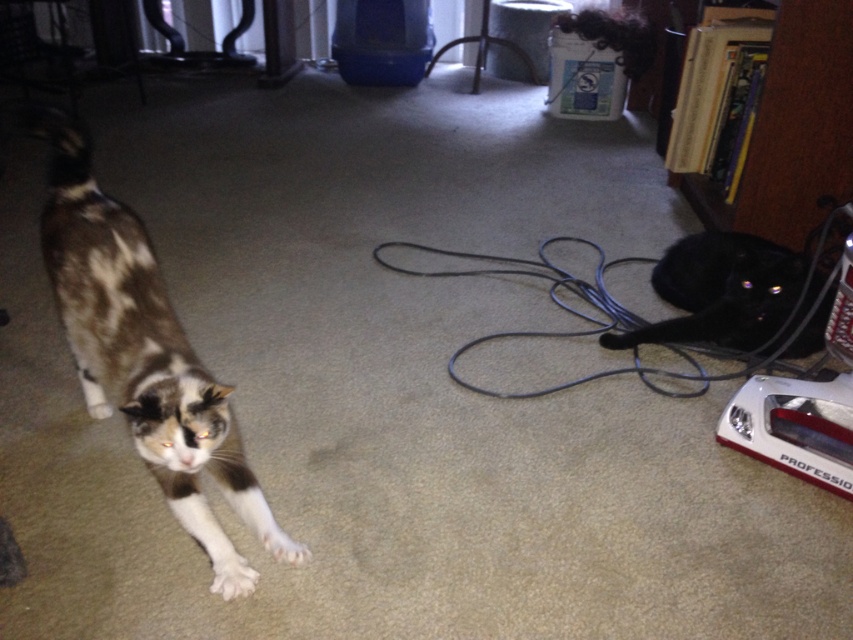
You are a photographer trying to capture a clear shot of the black glossy cat at lower right. The camera you are using has a focus point at coordinate 0.456, 0.845. Will this focus point help you capture the cat clearly?

Yes, the focus point at (x=720, y=291) is exactly where the black glossy cat at lower right is located, so it will help capture the cat clearly.

You are a photographer trying to capture both the calico fur cat at left and the white soft paw at lower left in a single frame. Given their sizes, which one will occupy more space in the photo?

The calico fur cat at left will occupy more space in the photo since its width surpasses that of the white soft paw at lower left.